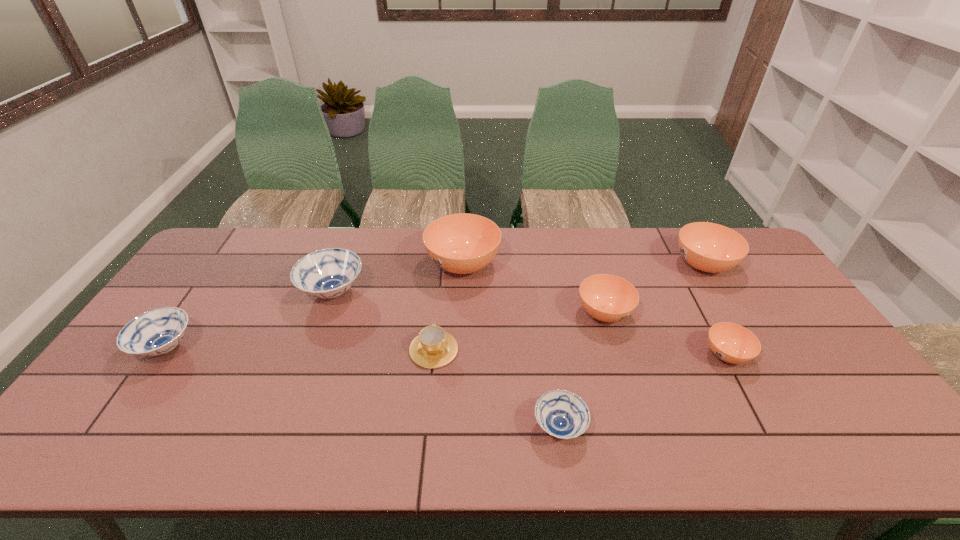
The width and height of the screenshot is (960, 540). Find the location of `the leftmost peach soup bowl`. the leftmost peach soup bowl is located at coordinates (463, 243).

The height and width of the screenshot is (540, 960). I want to click on the tallest soup bowl, so click(463, 243).

Locate an element on the screen. The width and height of the screenshot is (960, 540). the second biggest peach soup bowl is located at coordinates (709, 247).

Find the location of a particular element. the biggest blue soup bowl is located at coordinates (328, 273).

This screenshot has height=540, width=960. I want to click on the second blue soup bowl from left to right, so tap(328, 273).

The width and height of the screenshot is (960, 540). I want to click on the third soup bowl from right to left, so click(x=608, y=298).

The image size is (960, 540). Find the location of `the third farthest peach soup bowl`. the third farthest peach soup bowl is located at coordinates (608, 298).

Identify the location of the leftmost blue soup bowl. coord(156,332).

Find the location of a particular element. the leftmost soup bowl is located at coordinates (156, 332).

What are the coordinates of `the smallest peach soup bowl` in the screenshot? It's located at (732, 343).